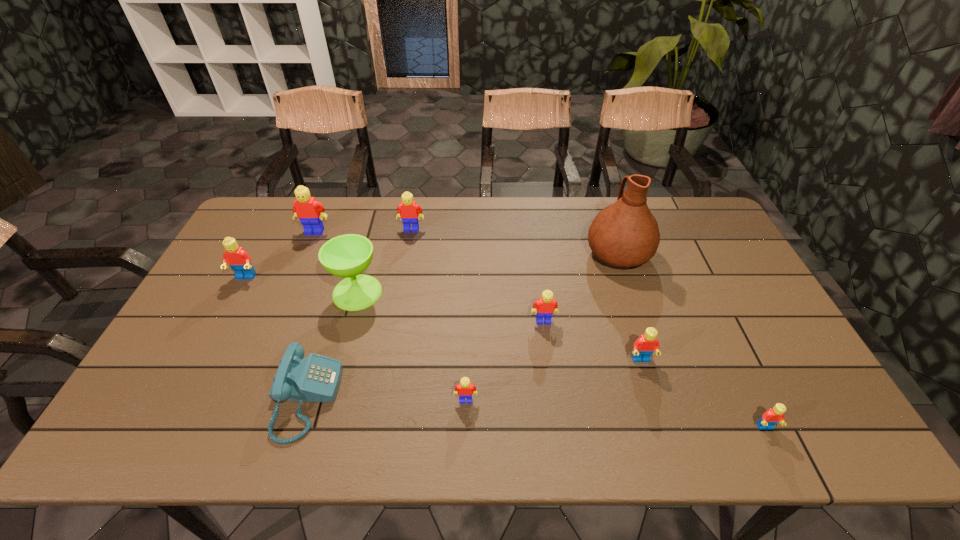
What are the coordinates of `Lego that is the third nearest to the sixth object from left to right` in the screenshot? It's located at (408, 210).

The width and height of the screenshot is (960, 540). I want to click on Lego identified as the third closest to the nearest yellow Lego, so click(408, 210).

Select which yellow Lego is the third closest to the third yellow Lego from right to left. Please provide its 2D coordinates. Your answer should be formatted as a tuple, i.e. [(x, y)], where the tuple contains the x and y coordinates of a point satisfying the conditions above.

[(465, 389)]

Identify the location of yellow Lego identified as the closest to the fifth object from right to left. The image size is (960, 540). 546,305.

What are the coordinates of `the third closest red Lego relative to the second biggest yellow Lego` in the screenshot? It's located at (774, 415).

I want to click on red Lego object that ranks as the second closest to the leftmost Lego, so click(x=774, y=415).